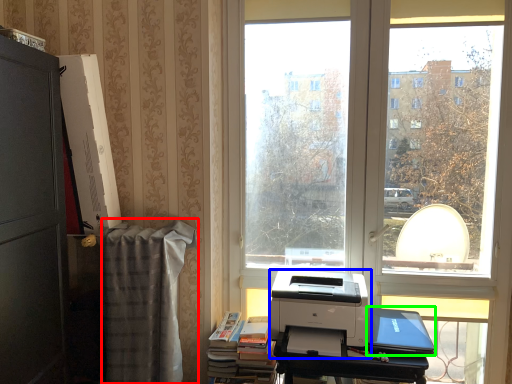
Question: Which is farther away from blanket (highlighted by a red box)? printer (highlighted by a blue box) or laptop (highlighted by a green box)?

Choices:
 (A) printer
 (B) laptop

Answer: (B)